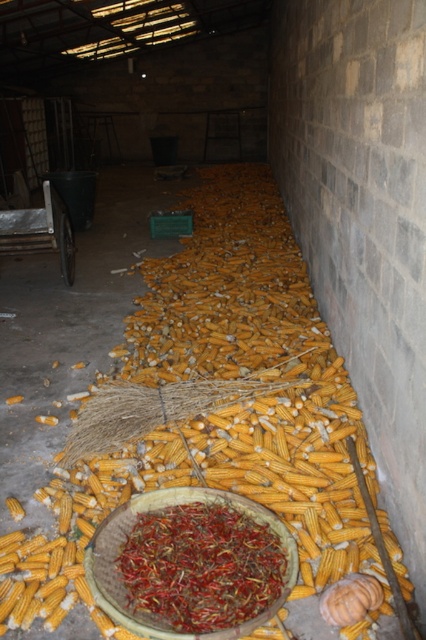
Question: Is yellow matte corn at center thinner than metallic silver cart at left?

Choices:
 (A) no
 (B) yes

Answer: (B)

Question: Is yellow matte corn at center thinner than metallic silver cart at left?

Choices:
 (A) no
 (B) yes

Answer: (B)

Question: Which point appears farthest from the camera in this image?

Choices:
 (A) (65, 269)
 (B) (180, 608)

Answer: (A)

Question: Which of the following is the farthest from the observer?

Choices:
 (A) (184, 576)
 (B) (48, 189)
 (C) (201, 264)

Answer: (C)

Question: Estimate the real-world distances between objects in this image. Which object is closer to the metallic silver cart at left?

Choices:
 (A) yellow matte corn at center
 (B) red dried chili at center

Answer: (B)

Question: Does yellow matte corn at center have a larger size compared to metallic silver cart at left?

Choices:
 (A) yes
 (B) no

Answer: (B)